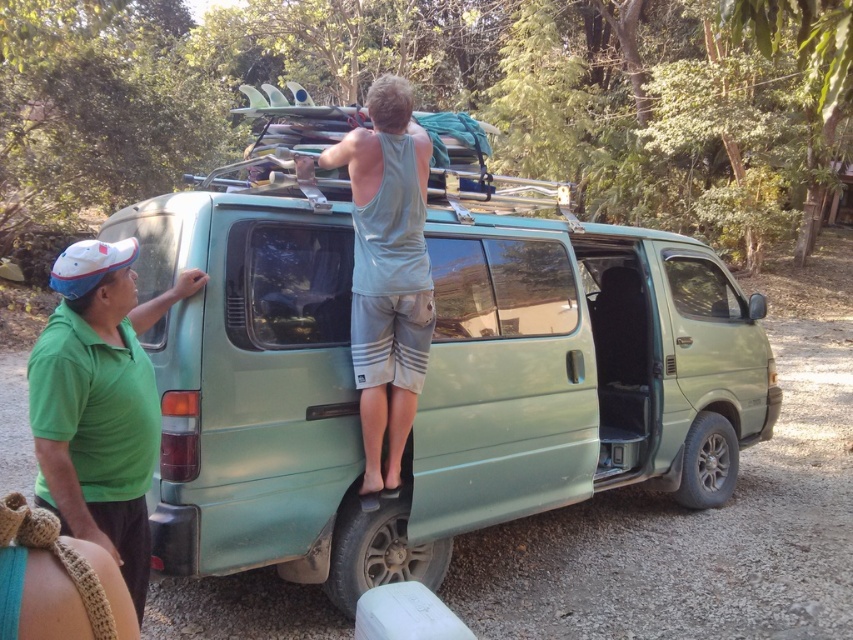
Question: Does green matte van at center come behind green matte shirt at left?

Choices:
 (A) yes
 (B) no

Answer: (A)

Question: Among these objects, which one is nearest to the camera?

Choices:
 (A) gray cotton shorts at center
 (B) green matte shirt at left

Answer: (B)

Question: Which point is farther to the camera?

Choices:
 (A) green matte van at center
 (B) gray cotton shorts at center

Answer: (B)

Question: Is green matte van at center bigger than gray cotton shorts at center?

Choices:
 (A) yes
 (B) no

Answer: (A)

Question: Is green matte van at center smaller than gray cotton shorts at center?

Choices:
 (A) no
 (B) yes

Answer: (A)

Question: Estimate the real-world distances between objects in this image. Which object is farther from the green matte shirt at left?

Choices:
 (A) green matte van at center
 (B) gray cotton shorts at center

Answer: (A)